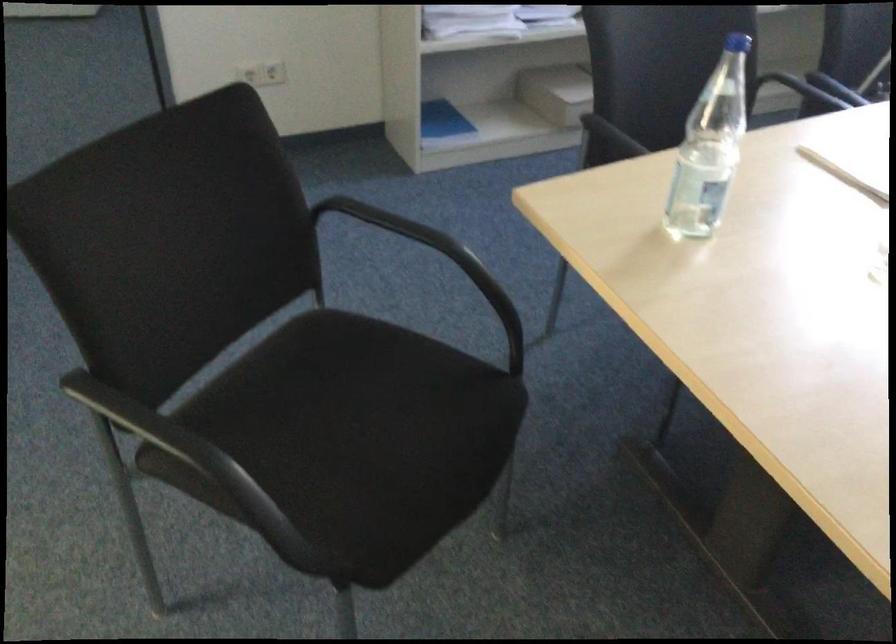
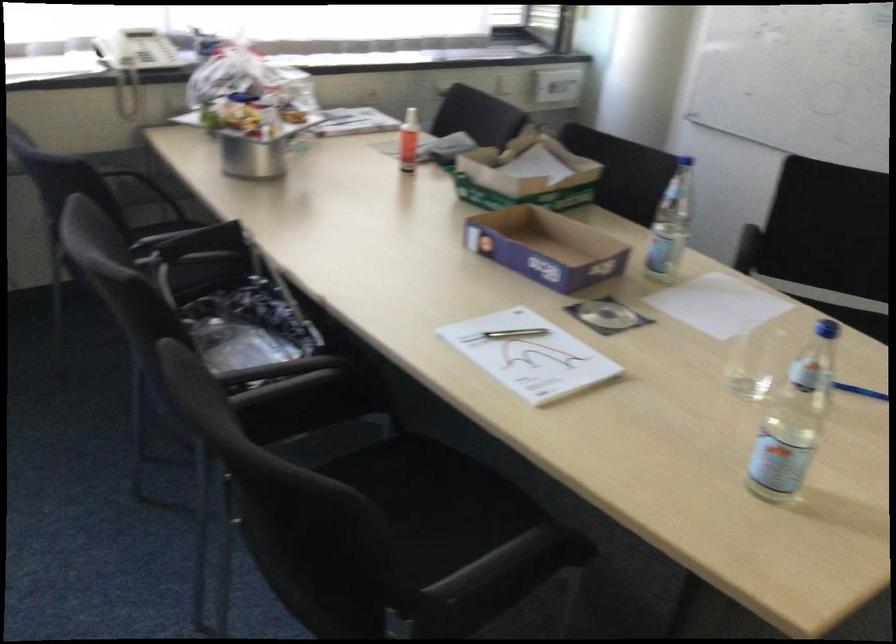
The point at (616, 152) is marked in the first image. Where is the corresponding point in the second image?

(513, 553)